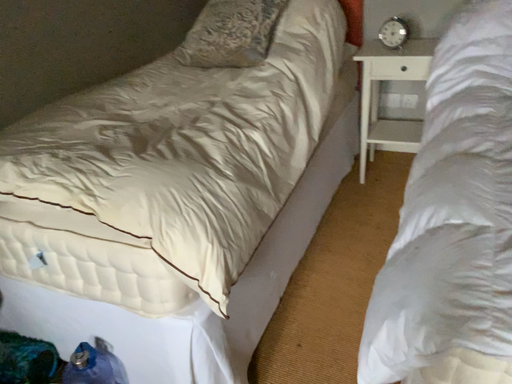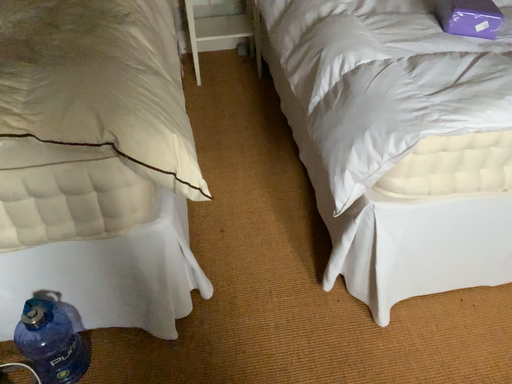
Question: Which way did the camera rotate in the video?

Choices:
 (A) rotated right
 (B) rotated left

Answer: (A)